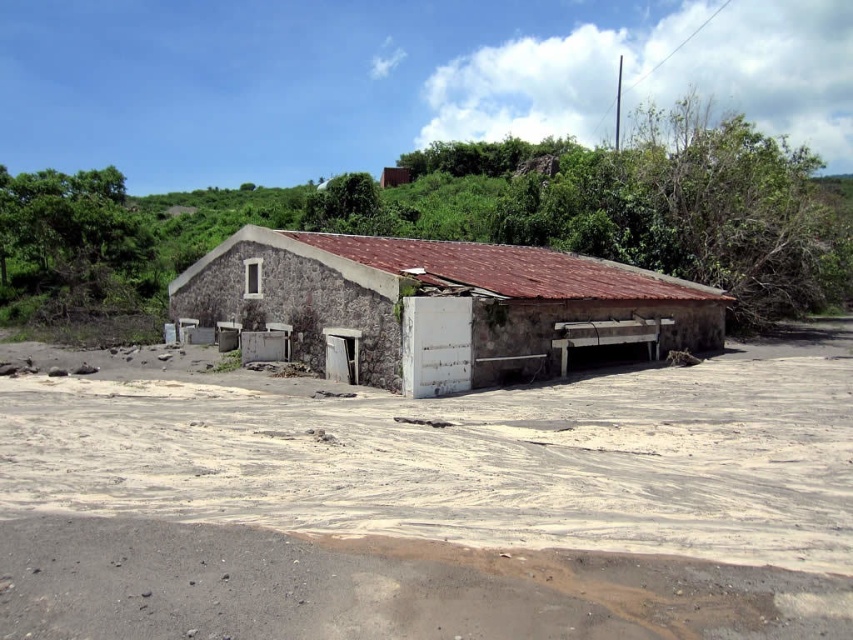
Question: Does white sandy dirt at center come behind stone textured hut at center?

Choices:
 (A) yes
 (B) no

Answer: (B)

Question: Among these points, which one is nearest to the camera?

Choices:
 (A) (532, 259)
 (B) (41, 458)

Answer: (B)

Question: Does white sandy dirt at center have a smaller size compared to stone textured hut at center?

Choices:
 (A) no
 (B) yes

Answer: (B)

Question: Which point is closer to the camera taking this photo?

Choices:
 (A) (375, 262)
 (B) (780, 592)

Answer: (B)

Question: Can you confirm if brown sandy ground at lower center is positioned above stone textured hut at center?

Choices:
 (A) yes
 (B) no

Answer: (B)

Question: Which of the following is the farthest from the observer?

Choices:
 (A) (276, 260)
 (B) (233, 620)

Answer: (A)